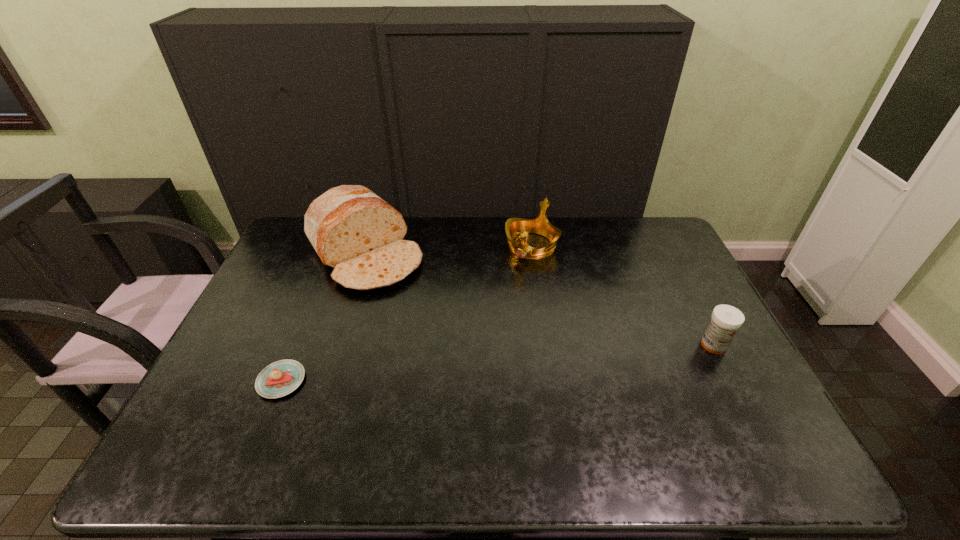
Find the location of a particular element. The height and width of the screenshot is (540, 960). free space between the nearest object and the bread is located at coordinates (323, 317).

Locate an element on the screen. The image size is (960, 540). free space between the second nearest object and the pastry is located at coordinates point(497,363).

The width and height of the screenshot is (960, 540). In order to click on empty space between the second object from right to left and the shortest object in this screenshot , I will do `click(406, 313)`.

Where is `free space that is in between the nearest object and the third object from left to right`? This screenshot has width=960, height=540. free space that is in between the nearest object and the third object from left to right is located at coordinates click(406, 313).

The width and height of the screenshot is (960, 540). What are the coordinates of `blank region between the bread and the medicine` in the screenshot? It's located at (540, 299).

Image resolution: width=960 pixels, height=540 pixels. What are the coordinates of `vacant area between the bread and the shortest object` in the screenshot? It's located at (323, 317).

Locate an element on the screen. The image size is (960, 540). blank region between the shortest object and the rightmost object is located at coordinates (497, 363).

The height and width of the screenshot is (540, 960). I want to click on vacant space that's between the bread and the tiara, so click(x=448, y=249).

Locate which object is the closest to the bread. Please provide its 2D coordinates. Your answer should be formatted as a tuple, i.e. [(x, y)], where the tuple contains the x and y coordinates of a point satisfying the conditions above.

[(282, 377)]

This screenshot has width=960, height=540. Find the location of `object identified as the closest to the medicine`. object identified as the closest to the medicine is located at coordinates (515, 227).